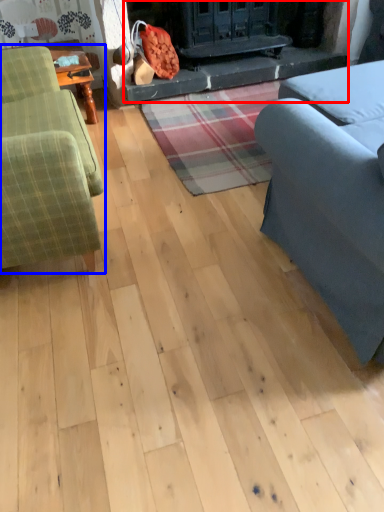
Question: Which of the following is the farthest to the observer, fireplace (highlighted by a red box) or studio couch (highlighted by a blue box)?

Choices:
 (A) fireplace
 (B) studio couch

Answer: (A)